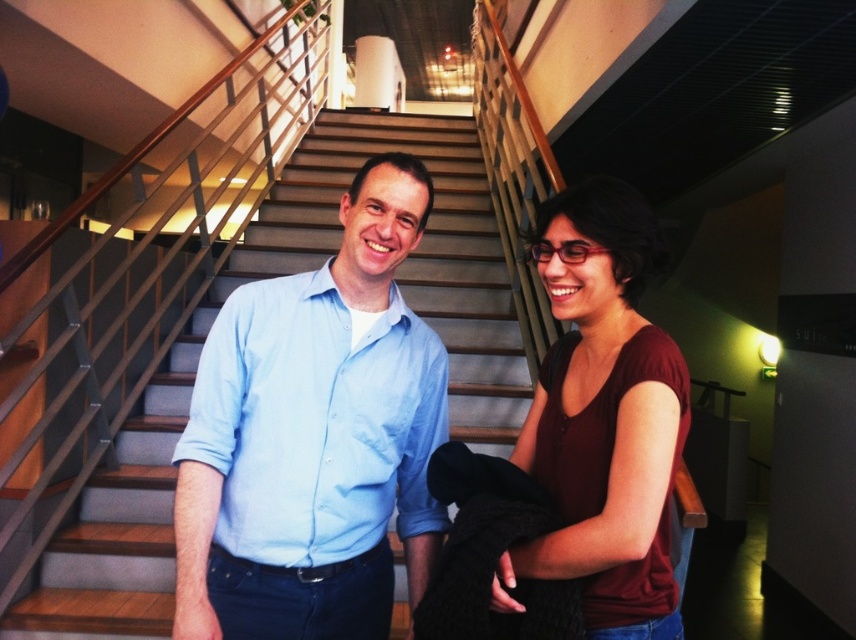
You are standing at the bottom of the wooden stairs at center and want to give a gift to the person wearing the matte burgundy shirt at center. In which direction should you move to reach them?

The wooden stairs at center is positioned on the left side of matte burgundy shirt at center, so you should move to the right to reach the person wearing the matte burgundy shirt at center.

Looking at this image, you are standing at the bottom of the staircase and see the point at coordinates [314,436]. Which object is that point located on?

The point at coordinates [314,436] is located on the light blue shirt at center.

You are standing at the top of the wooden stairs at center and want to greet the person wearing the light blue shirt at center. Which direction should you walk to reach them?

The light blue shirt at center is located below the wooden stairs at center, so you should walk downward along the wooden stairs at center to reach them.